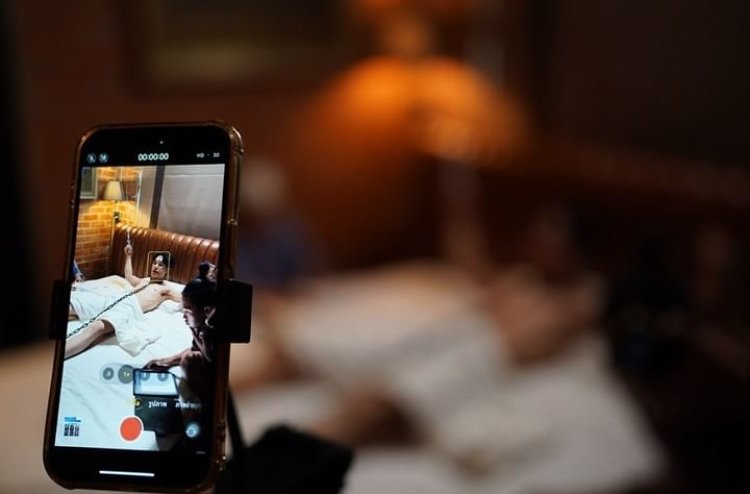
This screenshot has height=494, width=750. What are the coordinates of `bed sheet` in the screenshot? It's located at (118, 308), (421, 355).